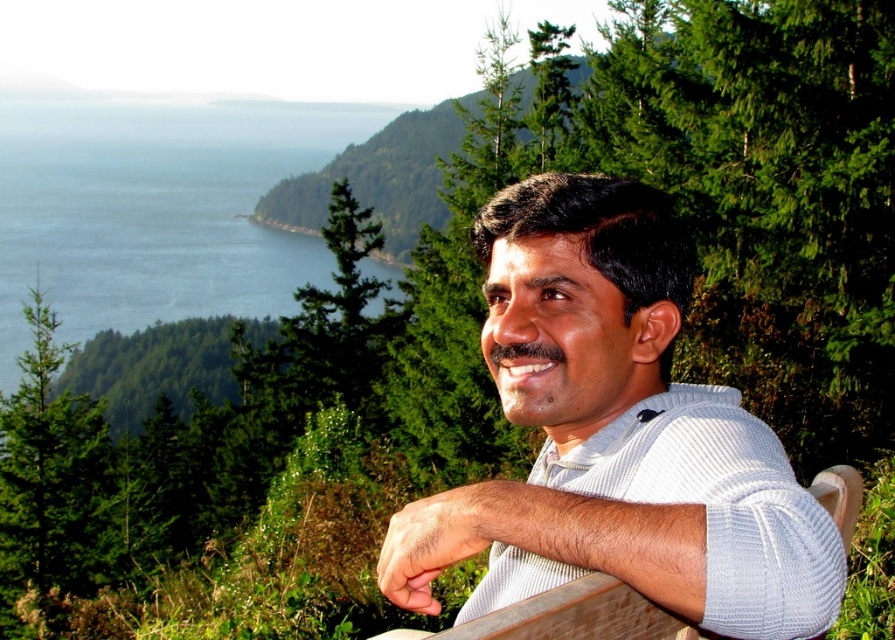
From the picture: You are an artist planning to paint the scene. You have a limited amount of blue paint and want to ensure you have enough for both the white ribbed sweater at center and the blue water at upper left. Which object requires more blue paint?

The blue water at upper left requires more blue paint because it is larger than the white ribbed sweater at center.

Based on the photo, you are standing at the point marked as point [522,560] in the image. You want to walk towards the man sitting on the wooden bench. Can you reach him without moving more than 1.32 meters?

Yes, because the distance between you and the man is exactly 1.32 meters, so you can reach him without moving more than that distance.

You are an artist trying to sketch the scene. You notice the white ribbed sweater at center and the blue water at upper left. Which object should you draw first if you want to follow the rule of drawing thinner objects before wider ones?

The white ribbed sweater at center should be drawn first because it is thinner than the blue water at upper left.